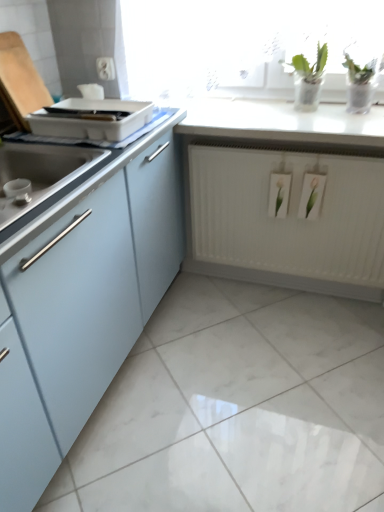
This screenshot has width=384, height=512. I want to click on vacant space situated on the left part of white matte radiator at center, so click(206, 317).